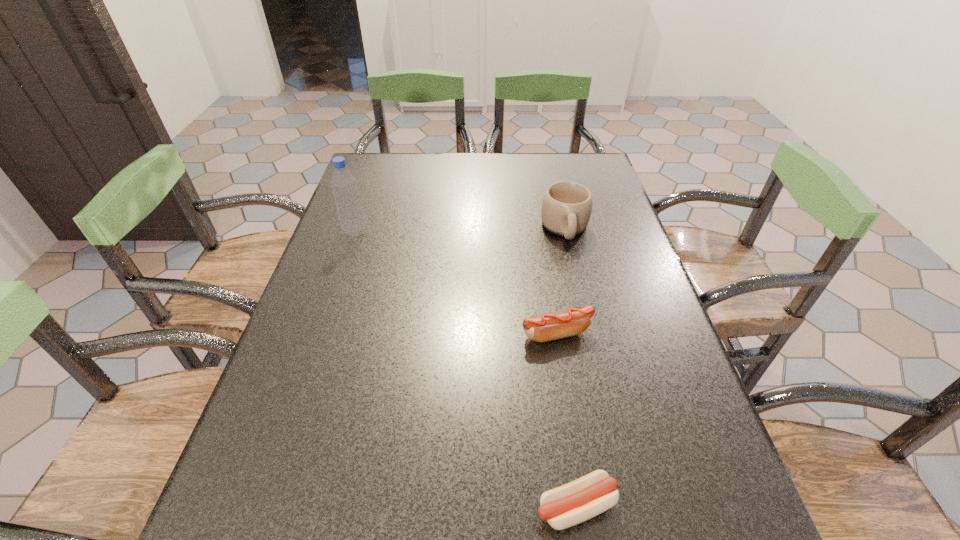
Image resolution: width=960 pixels, height=540 pixels. Identify the location of free point located 0.380m on the left of the nearest object. (290, 506).

Image resolution: width=960 pixels, height=540 pixels. Identify the location of object that is positioned at the left edge. (348, 203).

The width and height of the screenshot is (960, 540). I want to click on mug that is at the right edge, so [x=566, y=207].

Where is `sausage at the right edge`? sausage at the right edge is located at coordinates (572, 321).

Find the location of a particular element. vacant area at the far edge is located at coordinates (514, 156).

The image size is (960, 540). Find the location of `vacant space at the left edge of the desktop`. vacant space at the left edge of the desktop is located at coordinates (370, 289).

The width and height of the screenshot is (960, 540). In the image, there is a desktop. In order to click on free space at the right edge in this screenshot , I will do `click(619, 235)`.

The height and width of the screenshot is (540, 960). I want to click on vacant space at the far left corner of the desktop, so click(x=365, y=184).

This screenshot has height=540, width=960. Identify the location of free region at the far right corner. (555, 158).

Identify the location of empty location between the taller sausage and the second tallest object. (561, 281).